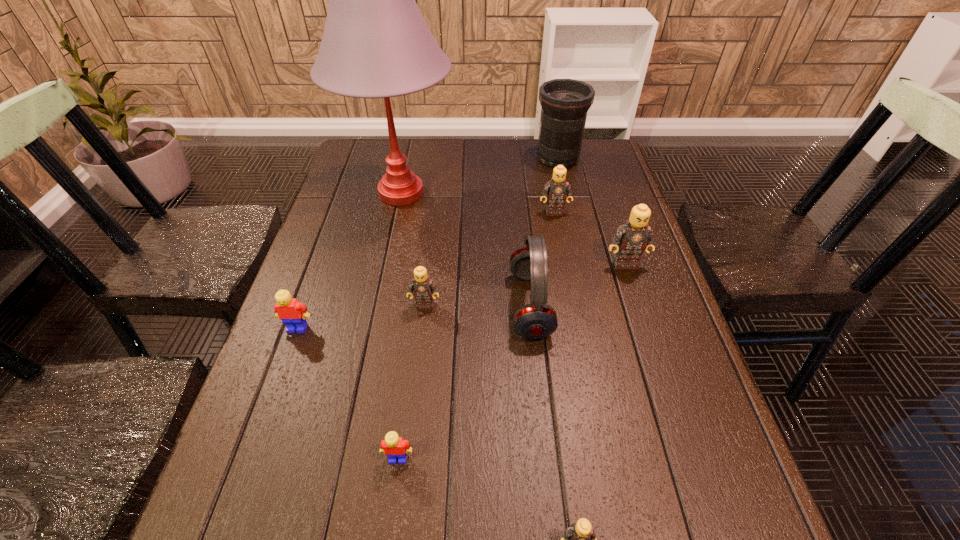
Locate an element on the screen. vacant area located in front of the farthest Lego is located at coordinates (565, 273).

Identify the location of free space located 0.250m on the front-facing side of the farther yellow Lego. The height and width of the screenshot is (540, 960). (255, 445).

Where is `free space located in front of the leftmost tan Lego`? free space located in front of the leftmost tan Lego is located at coordinates (421, 330).

Find the location of a particular element. The image size is (960, 540). vacant space situated 0.080m on the front-facing side of the second nearest Lego is located at coordinates (391, 514).

Identify the location of table lamp at the far edge. The width and height of the screenshot is (960, 540). (376, 44).

Locate an element on the screen. This screenshot has height=540, width=960. telephoto lens present at the far edge is located at coordinates (565, 102).

Where is `table lamp that is at the left edge`? The image size is (960, 540). table lamp that is at the left edge is located at coordinates (376, 44).

The image size is (960, 540). I want to click on Lego at the left edge, so click(292, 313).

Image resolution: width=960 pixels, height=540 pixels. I want to click on telephoto lens situated at the right edge, so click(x=565, y=102).

Where is `Lego located at the right edge`? Lego located at the right edge is located at coordinates (635, 235).